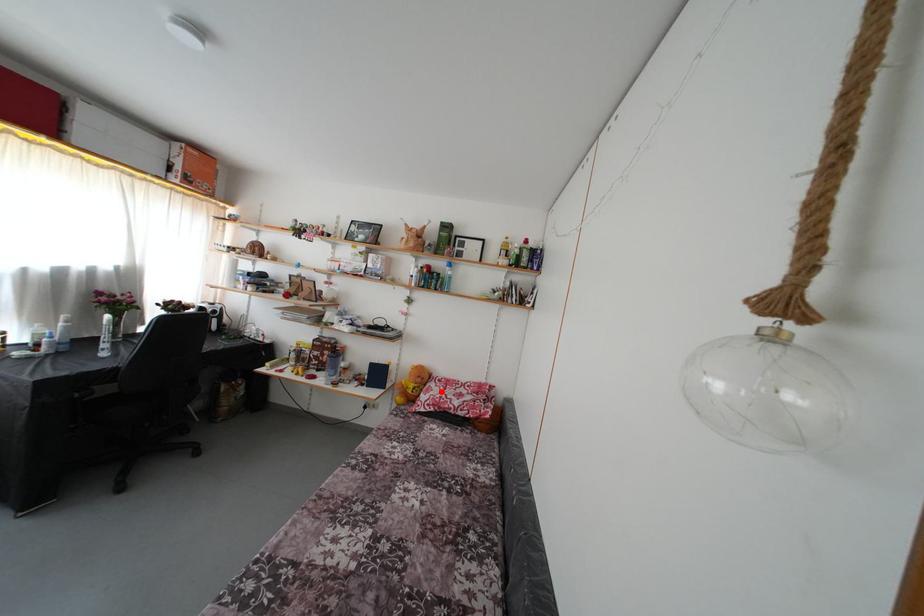
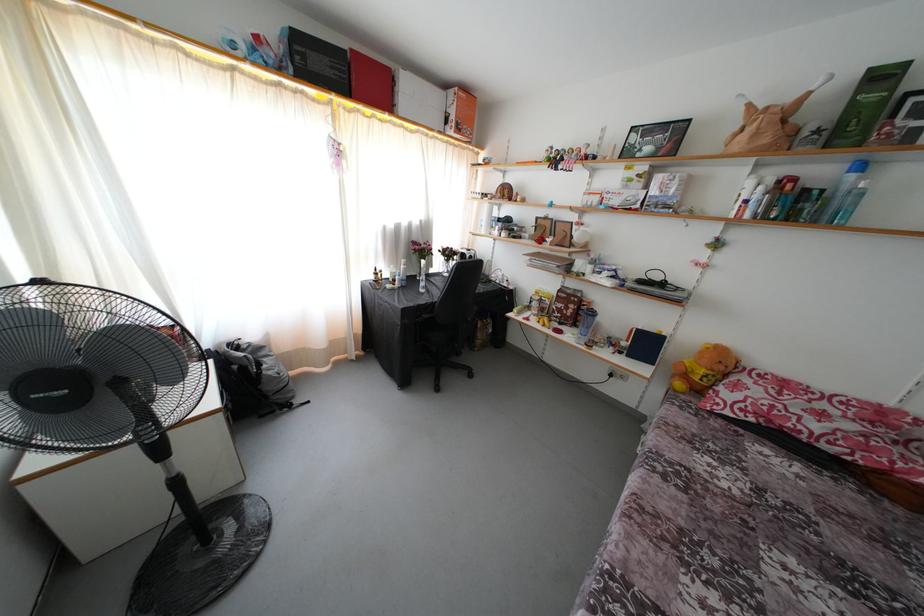
In the second image, find the point that corresponds to the highlighted location in the first image.

(760, 389)